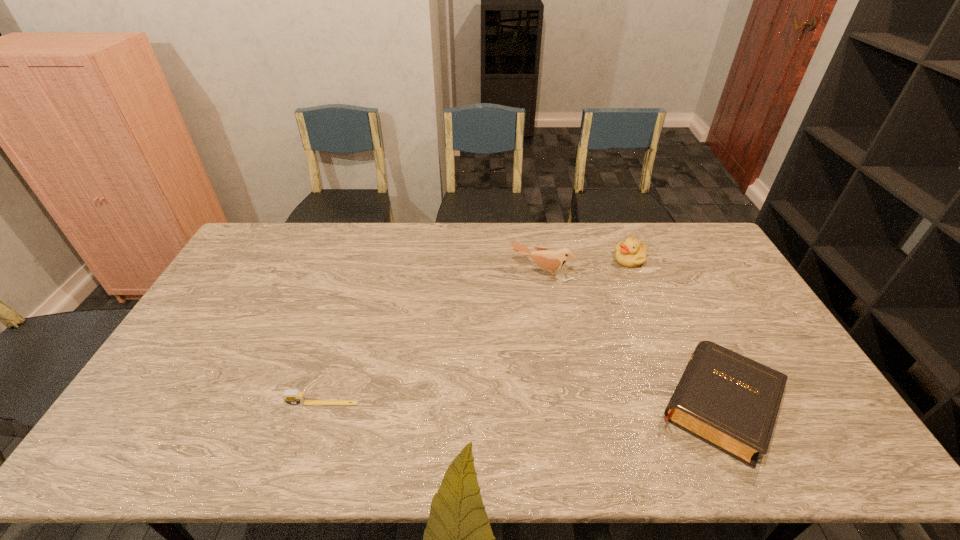
Locate an element on the screen. Image resolution: width=960 pixels, height=540 pixels. empty location between the second tallest object and the bird is located at coordinates (586, 266).

Where is `vacant space that's between the third shortest object and the leftmost object`? The width and height of the screenshot is (960, 540). vacant space that's between the third shortest object and the leftmost object is located at coordinates (476, 331).

Identify the location of free space between the tape measure and the bird. (432, 338).

You are a GUI agent. You are given a task and a screenshot of the screen. Output one action in this format:
    pyautogui.click(x=<x>, y=<y>)
    Task: Click on the vacant region between the second tallest object and the tape measure
    
    Given the screenshot: What is the action you would take?
    pyautogui.click(x=476, y=331)

Locate an element on the screen. object that is the closest one to the tape measure is located at coordinates (547, 259).

Identify which object is the closest to the bird. Please provide its 2D coordinates. Your answer should be formatted as a tuple, i.e. [(x, y)], where the tuple contains the x and y coordinates of a point satisfying the conditions above.

[(631, 253)]

Identify the location of free location that satisfies the following two spatial constraints: 1. on the front side of the duckling; 2. on the right side of the Bible. (689, 404).

Locate an element on the screen. Image resolution: width=960 pixels, height=540 pixels. free space in the image that satisfies the following two spatial constraints: 1. on the back side of the duckling; 2. on the right side of the second object from left to right is located at coordinates (540, 259).

What are the coordinates of `free point that satisfies the following two spatial constraints: 1. at the front of the Bible with the tape extended; 2. on the left side of the shortest object` in the screenshot? It's located at (322, 404).

Find the location of a particular element. This screenshot has height=540, width=960. vacant space that satisfies the following two spatial constraints: 1. at the front of the Bible with the tape extended; 2. on the right side of the tape measure is located at coordinates (322, 404).